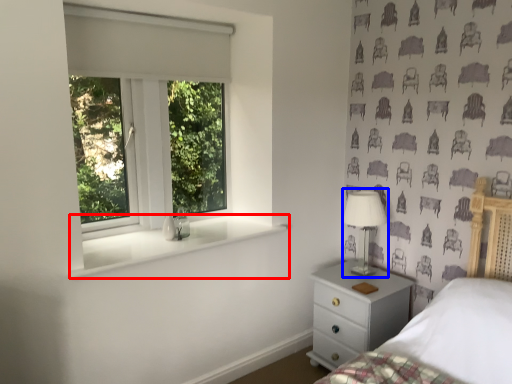
Question: Which object is further to the camera taking this photo, window sill (highlighted by a red box) or table lamp (highlighted by a blue box)?

Choices:
 (A) window sill
 (B) table lamp

Answer: (B)